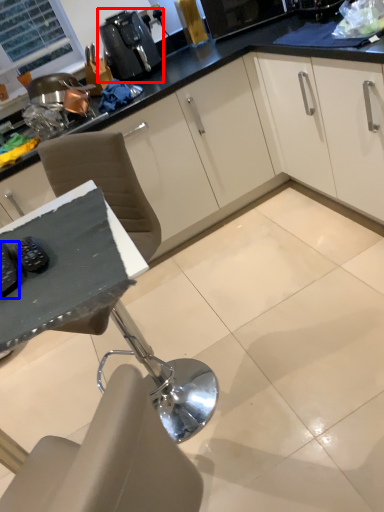
Question: Among these objects, which one is nearest to the camera, coffee machine (highlighted by a red box) or appliance (highlighted by a blue box)?

Choices:
 (A) coffee machine
 (B) appliance

Answer: (B)